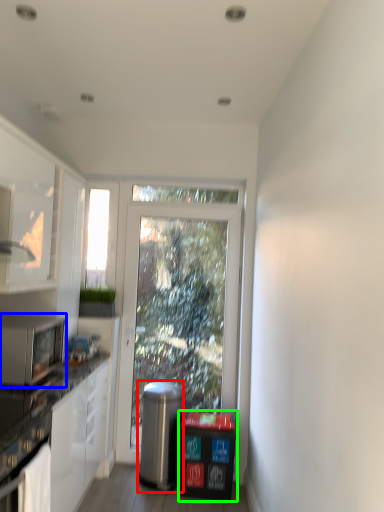
Question: Which object is the farthest from appliance (highlighted by a red box)? Choose among these: microwave oven (highlighted by a blue box) or recycling bin (highlighted by a green box).

Choices:
 (A) microwave oven
 (B) recycling bin

Answer: (A)